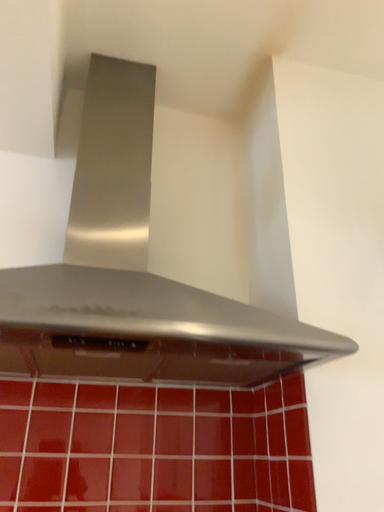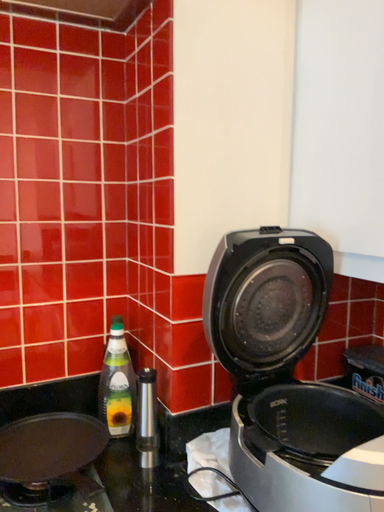
Question: Which way did the camera rotate in the video?

Choices:
 (A) rotated downward
 (B) rotated upward

Answer: (A)